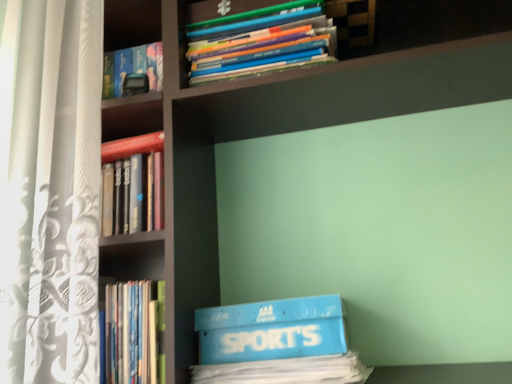
I want to click on blue cardboard box at lower center, so click(271, 330).

Describe the element at coordinates (271, 330) in the screenshot. The image size is (512, 384). I see `blue cardboard box at lower center` at that location.

Measure the distance between blue cardboard box at lower center and camera.

They are 78.63 centimeters apart.

Image resolution: width=512 pixels, height=384 pixels. I want to click on blue cardboard box at lower center, so click(x=271, y=330).